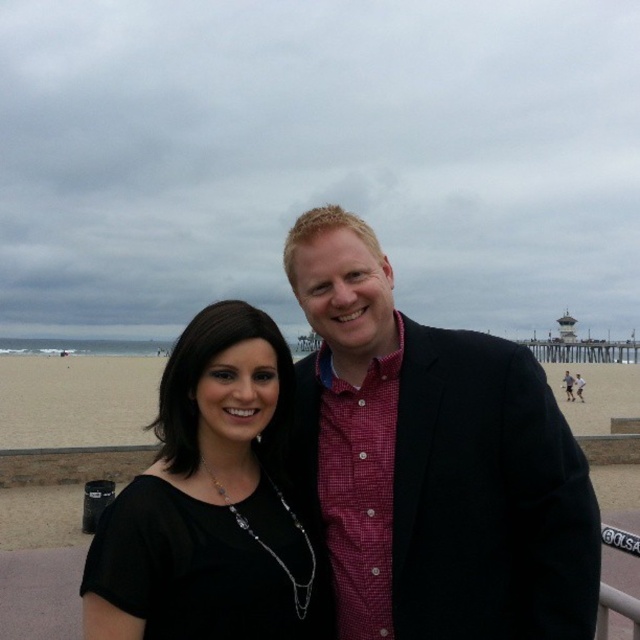
Question: Which point is closer to the camera?

Choices:
 (A) black fabric dress at center
 (B) red checkered shirt at center

Answer: (B)

Question: Is the position of red checkered shirt at center less distant than that of black fabric dress at center?

Choices:
 (A) yes
 (B) no

Answer: (A)

Question: Which object appears closest to the camera in this image?

Choices:
 (A) red checkered shirt at center
 (B) black fabric dress at center

Answer: (A)

Question: Which point is closer to the camera taking this photo?

Choices:
 (A) (545, 616)
 (B) (99, 584)

Answer: (B)

Question: Is red checkered shirt at center further to the viewer compared to black fabric dress at center?

Choices:
 (A) no
 (B) yes

Answer: (A)

Question: Can you confirm if red checkered shirt at center is positioned to the right of black fabric dress at center?

Choices:
 (A) no
 (B) yes

Answer: (B)